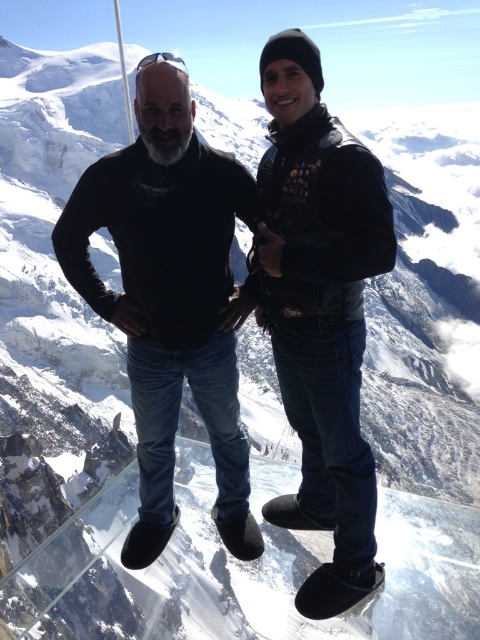
Question: Which of the following is the farthest from the observer?

Choices:
 (A) black leather jacket at center
 (B) black matte sweater at center

Answer: (B)

Question: Which object is closer to the camera taking this photo?

Choices:
 (A) black matte sweater at center
 (B) black leather jacket at center

Answer: (B)

Question: Is black matte sweater at center in front of black leather jacket at center?

Choices:
 (A) yes
 (B) no

Answer: (B)

Question: Can you confirm if black matte sweater at center is positioned to the left of black leather jacket at center?

Choices:
 (A) no
 (B) yes

Answer: (B)

Question: Which point is farther from the camera taking this photo?

Choices:
 (A) (149, 93)
 (B) (317, 362)

Answer: (B)

Question: Is black matte sweater at center thinner than black leather jacket at center?

Choices:
 (A) no
 (B) yes

Answer: (A)